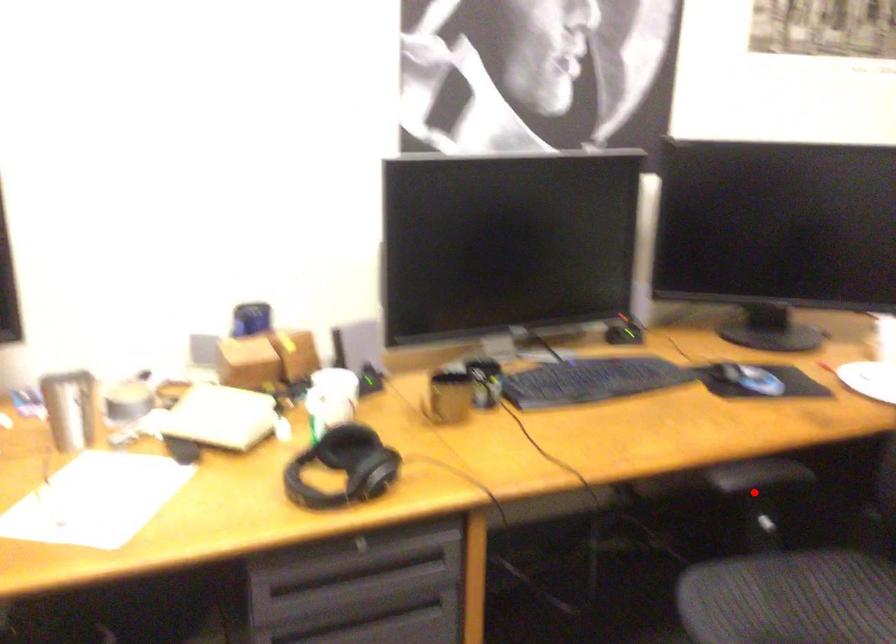
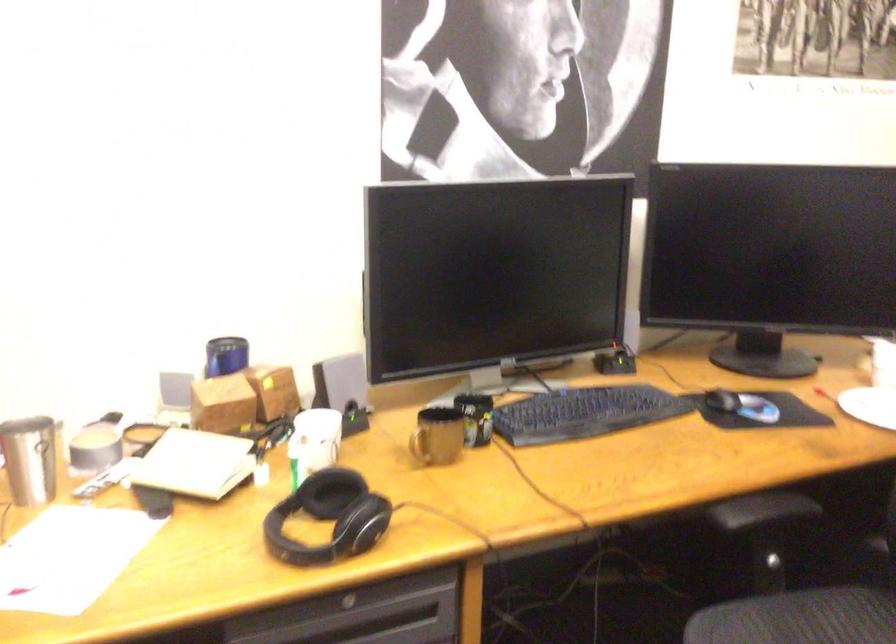
Find the pixel in the second image that matches the highlighted location in the first image.

(762, 529)